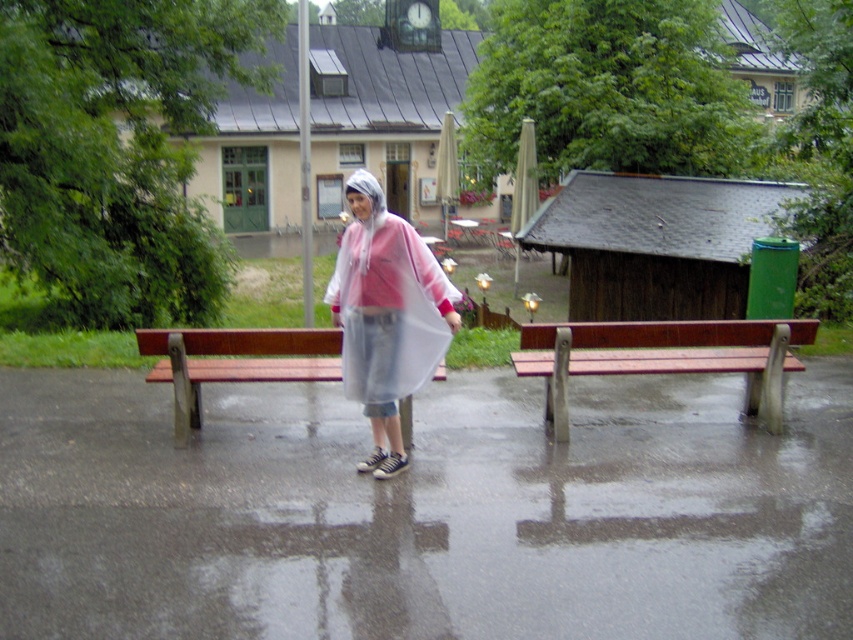
Is the position of wooden bench at right less distant than that of brown wooden bench at left?

That is False.

Is point (697, 371) farther from camera compared to point (276, 336)?

Yes, it is.

You are a GUI agent. You are given a task and a screenshot of the screen. Output one action in this format:
    pyautogui.click(x=<x>, y=<y>)
    Task: Click on the wooden bench at right
    The image size is (853, 640).
    Given the screenshot: What is the action you would take?
    [x=664, y=356]

Can you confirm if transparent plastic poncho at center is bigger than wooden bench at right?

Incorrect, transparent plastic poncho at center is not larger than wooden bench at right.

Is point (405, 380) closer to camera compared to point (544, 356)?

That is True.

Find the location of a particular element. The image size is (853, 640). transparent plastic poncho at center is located at coordinates (386, 316).

Can you confirm if transparent plastic poncho at center is wider than brown wooden bench at left?

Incorrect, transparent plastic poncho at center's width does not surpass brown wooden bench at left's.

Between point (402, 374) and point (339, 337), which one is positioned behind?

Point (339, 337)

Between point (383, 284) and point (265, 332), which one is positioned behind?

Point (265, 332)

Identify the location of transparent plastic poncho at center. The image size is (853, 640). (386, 316).